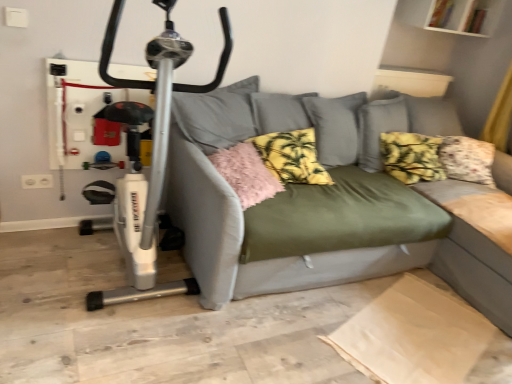
Identify the location of free point in front of white plastic exercise bike at left. (93, 339).